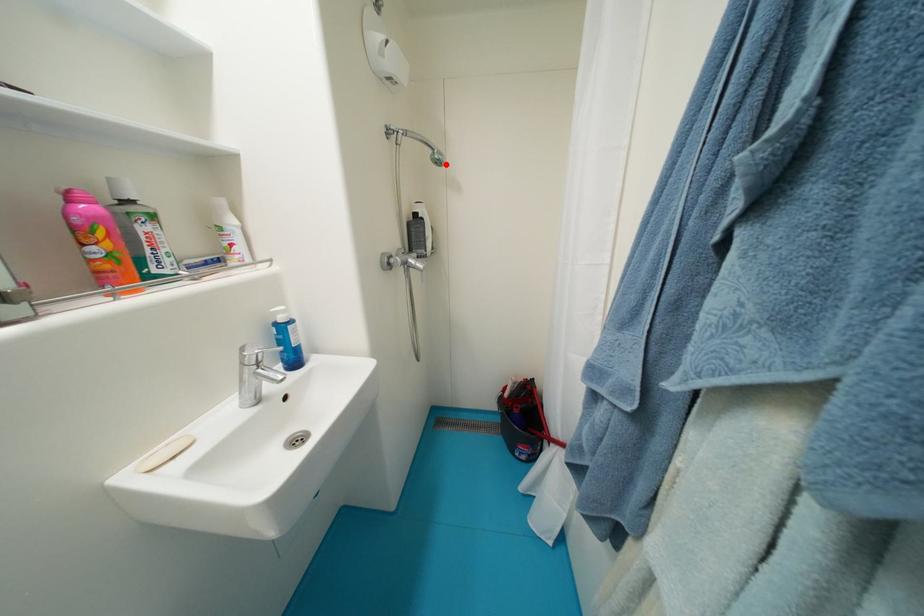
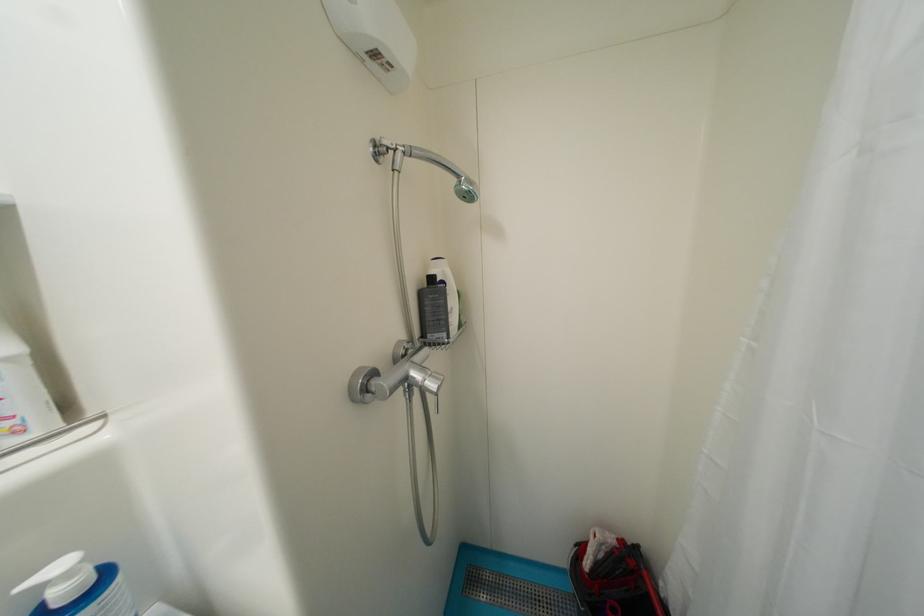
The point at the highlighted location is marked in the first image. Where is the corresponding point in the second image?

(476, 199)